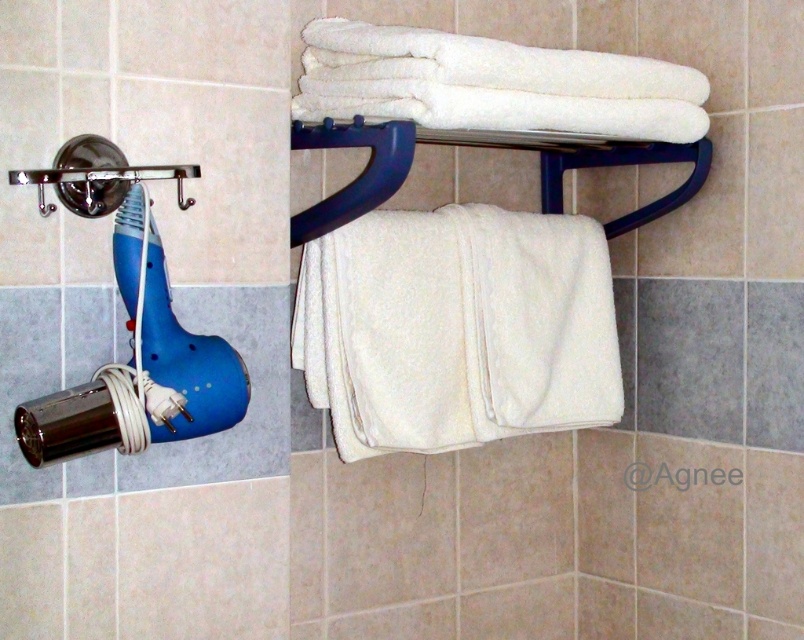
You are a guest in this bathroom and need to hang a small backpack. The backpack is 30 cm tall. You see the white soft towel at upper right and the brushed metal shower head at left. Which object can the backpack be hung from without exceeding its height?

The backpack can be hung from the white soft towel at upper right because it is taller than the brushed metal shower head at left, which means it can accommodate the 30 cm height of the backpack.

You are organizing towels in the bathroom and need to place a new white soft towel between the existing ones. Which position should you choose to maintain symmetry between the white soft towel at upper right and the white soft towel at upper center?

To maintain symmetry between the white soft towel at upper right and the white soft towel at upper center, you should place the new towel in the center between them, as the existing white soft towel at upper right is already on the right side of the white soft towel at upper center.